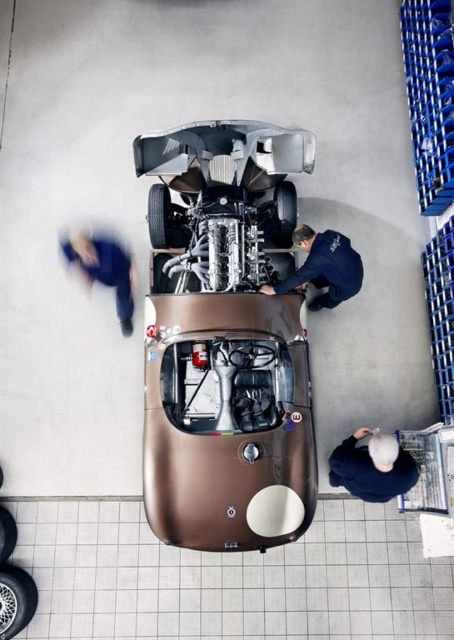
Question: Does shiny metallic race car at center have a smaller size compared to blue fabric jacket at upper left?

Choices:
 (A) yes
 (B) no

Answer: (B)

Question: Where is dark blue shirt at lower right located in relation to dark blue uniform at center in the image?

Choices:
 (A) below
 (B) above

Answer: (A)

Question: Which point is closer to the camera?

Choices:
 (A) blue fabric jacket at upper left
 (B) shiny metallic race car at center
 (C) dark blue uniform at center

Answer: (B)

Question: Is dark blue shirt at lower right behind blue fabric jacket at upper left?

Choices:
 (A) no
 (B) yes

Answer: (A)

Question: Which is farther from the dark blue shirt at lower right?

Choices:
 (A) shiny metallic race car at center
 (B) blue fabric jacket at upper left
 (C) dark blue uniform at center

Answer: (B)

Question: Among these objects, which one is farthest from the camera?

Choices:
 (A) dark blue uniform at center
 (B) blue fabric jacket at upper left

Answer: (B)